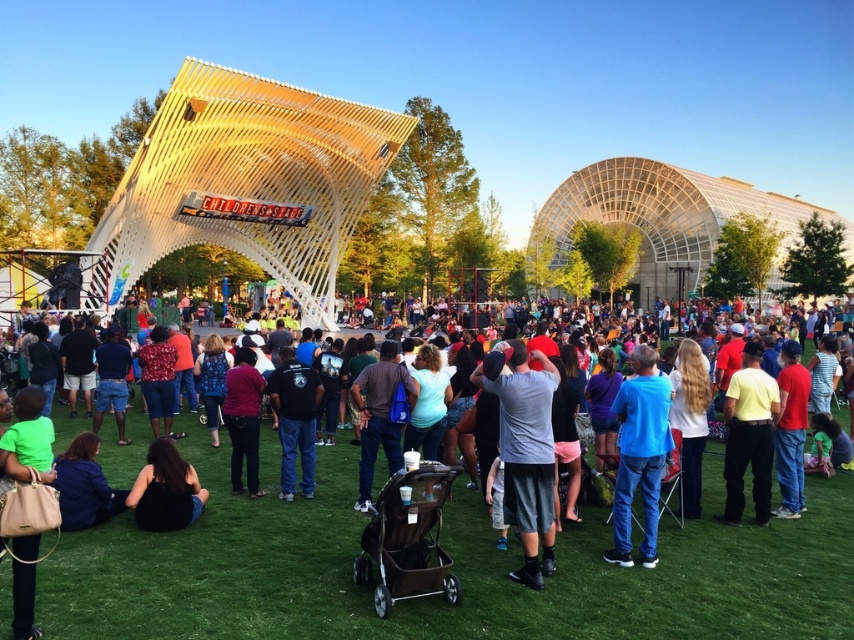
Question: Which object is closer to the camera taking this photo?

Choices:
 (A) dark red sweater at center
 (B) dark blue fabric backpack at center
 (C) gray fabric shirt at center

Answer: (C)

Question: Is black fabric at lower center thinner than blue fabric jacket at lower left?

Choices:
 (A) yes
 (B) no

Answer: (A)

Question: Which of these objects is positioned closest to the blue fabric jacket at lower left?

Choices:
 (A) black cotton shirt at center
 (B) black fabric at lower center

Answer: (B)

Question: Does yellow matte shirt at center-right lie in front of black cotton shirt at center?

Choices:
 (A) no
 (B) yes

Answer: (B)

Question: Which object is farther from the camera taking this photo?

Choices:
 (A) blue fabric jacket at lower left
 (B) yellow matte shirt at center-right

Answer: (B)

Question: Is black cotton shirt at center positioned in front of red cotton shirt at center?

Choices:
 (A) no
 (B) yes

Answer: (A)